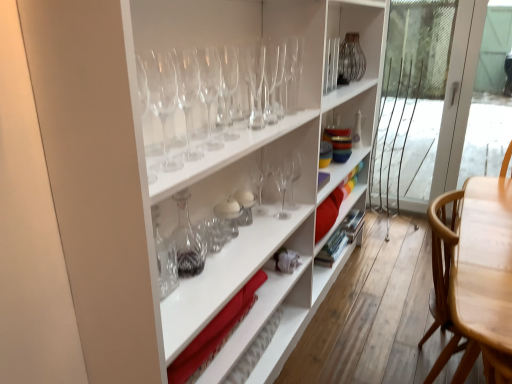
Question: From the image's perspective, would you say transparent glass wine glasses at upper center, acting as the 2th wine glass starting from the front, is shown under transparent glass wine glass at upper center, arranged as the 4th wine glass when viewed from the front?

Choices:
 (A) no
 (B) yes

Answer: (B)

Question: From the image's perspective, is transparent glass wine glasses at upper center, acting as the 2th wine glass starting from the front, located above transparent glass wine glass at upper center, arranged as the 4th wine glass when viewed from the front?

Choices:
 (A) no
 (B) yes

Answer: (A)

Question: From a real-world perspective, is transparent glass wine glasses at upper center, acting as the 2th wine glass starting from the front, on transparent glass wine glass at upper center, acting as the 7th wine glass starting from the back?

Choices:
 (A) yes
 (B) no

Answer: (B)

Question: Does transparent glass wine glasses at upper center, acting as the 2th wine glass starting from the front, appear on the left side of transparent glass wine glass at upper center, arranged as the 4th wine glass when viewed from the front?

Choices:
 (A) yes
 (B) no

Answer: (A)

Question: Is transparent glass wine glasses at upper center, which is the 9th wine glass from back to front, directly adjacent to transparent glass wine glass at upper center, acting as the 7th wine glass starting from the back?

Choices:
 (A) no
 (B) yes

Answer: (A)

Question: Is clear glass wine glass at center, which is the 3th wine glass from front to back, inside the boundaries of transparent glass wine glass at center, which is the fifth wine glass from front to back, or outside?

Choices:
 (A) inside
 (B) outside

Answer: (B)

Question: Considering their positions, is clear glass wine glass at center, which is the 3th wine glass from front to back, located in front of or behind transparent glass wine glass at center, arranged as the sixth wine glass when viewed from the back?

Choices:
 (A) behind
 (B) front

Answer: (B)

Question: Is clear glass wine glass at center, which appears as the 8th wine glass when viewed from the back, taller or shorter than transparent glass wine glass at center, which is the fifth wine glass from front to back?

Choices:
 (A) short
 (B) tall

Answer: (A)

Question: Does point (204, 57) appear closer or farther from the camera than point (248, 44)?

Choices:
 (A) closer
 (B) farther

Answer: (A)

Question: Considering the positions of clear glass wine glass at upper center, the seventh wine glass when ordered from front to back, and transparent glass wine glass at upper center, acting as the 7th wine glass starting from the back, in the image, is clear glass wine glass at upper center, the seventh wine glass when ordered from front to back, wider or thinner than transparent glass wine glass at upper center, acting as the 7th wine glass starting from the back,?

Choices:
 (A) thin
 (B) wide

Answer: (A)

Question: Is clear glass wine glass at upper center, which is counted as the 4th wine glass, starting from the back, taller or shorter than transparent glass wine glass at upper center, acting as the 7th wine glass starting from the back?

Choices:
 (A) tall
 (B) short

Answer: (A)

Question: In the image, is clear glass wine glass at upper center, the seventh wine glass when ordered from front to back, on the left side or the right side of transparent glass wine glass at upper center, arranged as the 4th wine glass when viewed from the front?

Choices:
 (A) left
 (B) right

Answer: (B)

Question: Considering their positions, is clear glass wine glass at upper center, which is counted as the 4th wine glass, starting from the back, located in front of or behind transparent glass wine glass at upper center, acting as the 7th wine glass starting from the back?

Choices:
 (A) front
 (B) behind

Answer: (B)

Question: From the image's perspective, is clear glass wine glass at upper center, the seventh wine glass when ordered from front to back, located above or below transparent glass wine glass at center, which is the fifth wine glass from front to back?

Choices:
 (A) above
 (B) below

Answer: (A)

Question: Is clear glass wine glass at upper center, which is counted as the 4th wine glass, starting from the back, situated inside transparent glass wine glass at center, which is the fifth wine glass from front to back, or outside?

Choices:
 (A) outside
 (B) inside

Answer: (A)